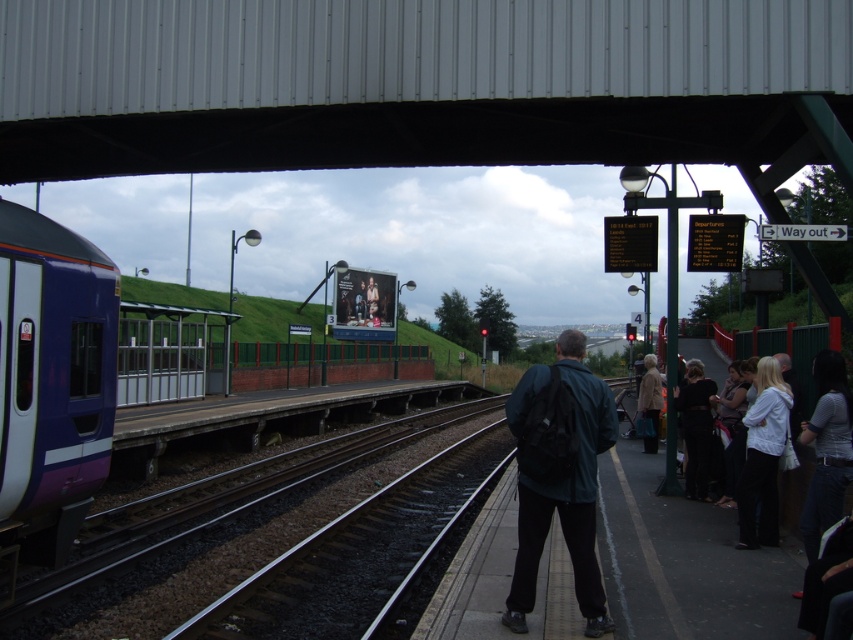
You are standing on the train station platform and want to go to the metallic gray overpass at upper center. Based on your current position, in which direction should you walk to reach it?

The metallic gray overpass at upper center is located at point (x=415, y=83), so you should walk towards the upper center direction to reach it.

You are a passenger waiting at the train station. You see the purple glossy train at left and the dark green jacket at center. Which object is located to the left of the other?

The purple glossy train at left is positioned on the left side of dark green jacket at center.

You are standing on the train station platform and see a point marked at coordinates [51,385]. Based on the scene description, can you determine which object this point is located on?

The point at coordinates [51,385] is located on the purple glossy train at left.